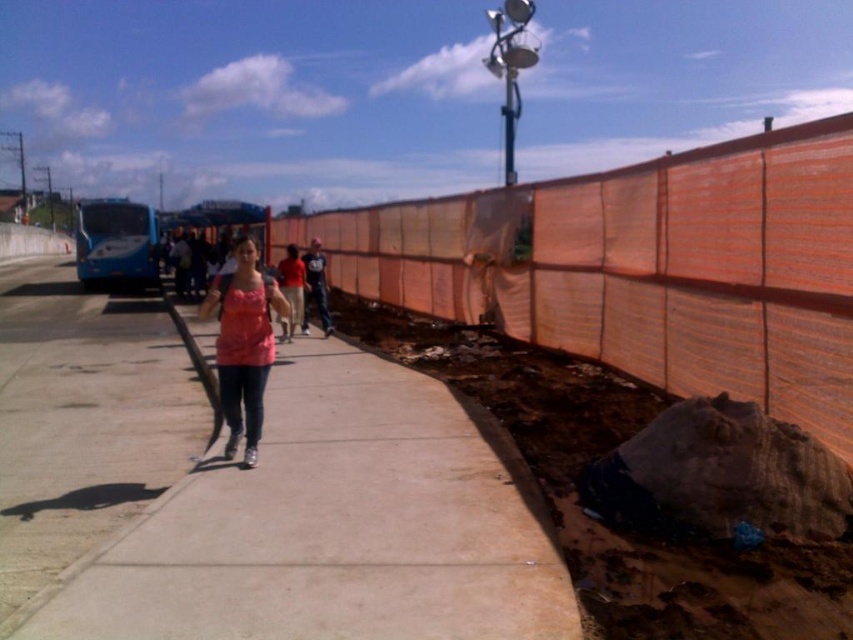
Question: Is smooth concrete sidewalk at center smaller than pink matte shirt at center?

Choices:
 (A) no
 (B) yes

Answer: (B)

Question: In this image, where is orange mesh fence at center located relative to pink matte shirt at center?

Choices:
 (A) right
 (B) left

Answer: (A)

Question: Considering the real-world distances, which object is farthest from the concrete sidewalk at center?

Choices:
 (A) smooth concrete sidewalk at center
 (B) pink matte shirt at center

Answer: (B)

Question: Estimate the real-world distances between objects in this image. Which object is farther from the dark blue jeans at center?

Choices:
 (A) matte pink tank top at center
 (B) smooth concrete sidewalk at center
 (C) concrete sidewalk at center

Answer: (A)

Question: Is smooth concrete sidewalk at center smaller than matte pink tank top at center?

Choices:
 (A) no
 (B) yes

Answer: (A)

Question: Which of these objects is positioned farthest from the matte pink tank top at center?

Choices:
 (A) dark blue jeans at center
 (B) orange mesh fence at center

Answer: (B)